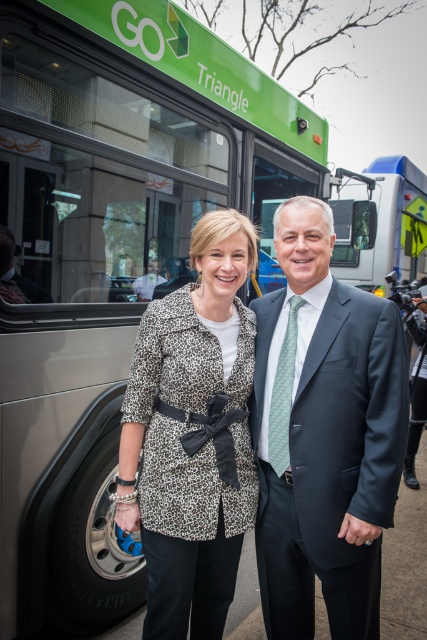
Question: Can you confirm if dark gray suit at center is bigger than leopard print coat at center?

Choices:
 (A) yes
 (B) no

Answer: (A)

Question: Which of the following is the closest to the observer?

Choices:
 (A) leopard print coat at center
 (B) dark gray suit at center

Answer: (B)

Question: Can you confirm if dark gray suit at center is smaller than leopard print coat at center?

Choices:
 (A) yes
 (B) no

Answer: (B)

Question: Does dark gray suit at center appear on the right side of leopard print coat at center?

Choices:
 (A) yes
 (B) no

Answer: (A)

Question: Which point is farther to the camera?

Choices:
 (A) (233, 381)
 (B) (330, 604)

Answer: (A)